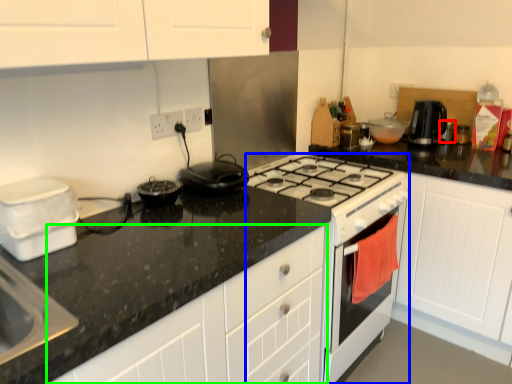
Question: Which object is the farthest from appliance (highlighted by a red box)? Choose among these: appliance (highlighted by a blue box) or cabinetry (highlighted by a green box).

Choices:
 (A) appliance
 (B) cabinetry

Answer: (B)